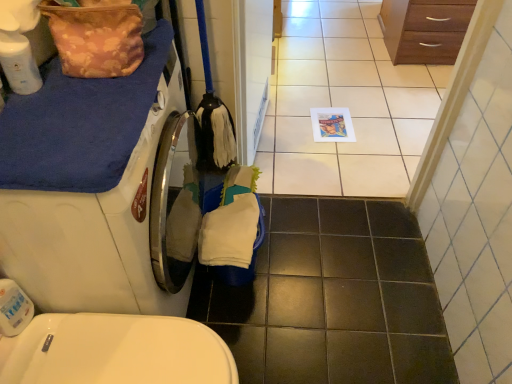
Question: From the image's perspective, is floral fabric bag at upper left on white glossy screen door at center?

Choices:
 (A) yes
 (B) no

Answer: (B)

Question: From a real-world perspective, is floral fabric bag at upper left located higher than white glossy screen door at center?

Choices:
 (A) no
 (B) yes

Answer: (B)

Question: Considering the relative sizes of floral fabric bag at upper left and white glossy screen door at center in the image provided, is floral fabric bag at upper left wider than white glossy screen door at center?

Choices:
 (A) no
 (B) yes

Answer: (B)

Question: Can you confirm if floral fabric bag at upper left is bigger than white glossy screen door at center?

Choices:
 (A) yes
 (B) no

Answer: (B)

Question: Is floral fabric bag at upper left with white glossy screen door at center?

Choices:
 (A) yes
 (B) no

Answer: (B)

Question: Considering the positions of point (81, 46) and point (344, 74), is point (81, 46) closer or farther from the camera than point (344, 74)?

Choices:
 (A) closer
 (B) farther

Answer: (A)

Question: Is floral fabric bag at upper left wider or thinner than white glossy tile at center?

Choices:
 (A) thin
 (B) wide

Answer: (A)

Question: Would you say floral fabric bag at upper left is to the left or to the right of white glossy tile at center in the picture?

Choices:
 (A) left
 (B) right

Answer: (A)

Question: Is floral fabric bag at upper left taller or shorter than white glossy tile at center?

Choices:
 (A) tall
 (B) short

Answer: (A)

Question: From the image's perspective, is wooden chest of drawers at upper right above or below white glossy screen door at center?

Choices:
 (A) above
 (B) below

Answer: (A)

Question: Looking at their shapes, would you say wooden chest of drawers at upper right is wider or thinner than white glossy screen door at center?

Choices:
 (A) thin
 (B) wide

Answer: (B)

Question: Considering the positions of point (415, 3) and point (267, 64), is point (415, 3) closer or farther from the camera than point (267, 64)?

Choices:
 (A) farther
 (B) closer

Answer: (A)

Question: Relative to white glossy screen door at center, is wooden chest of drawers at upper right in front or behind?

Choices:
 (A) front
 (B) behind

Answer: (B)

Question: From a real-world perspective, is white glossy tile at center above or below white glossy screen door at center?

Choices:
 (A) below
 (B) above

Answer: (A)

Question: Is point (327, 87) positioned closer to the camera than point (262, 69)?

Choices:
 (A) closer
 (B) farther

Answer: (B)